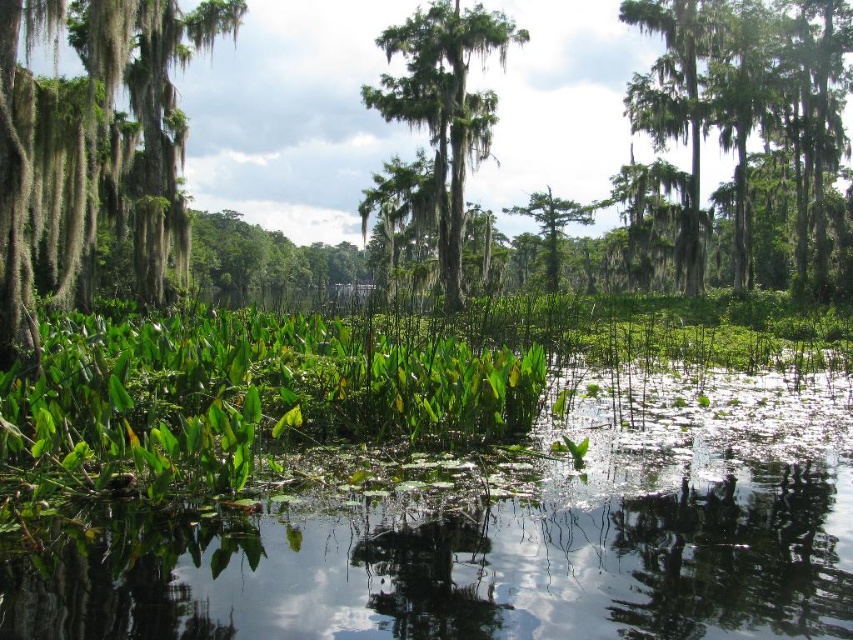
Question: Which point is farther to the camera?

Choices:
 (A) (544, 216)
 (B) (439, 51)
 (C) (788, 20)

Answer: (A)

Question: Based on their relative distances, which object is nearer to the green mossy tree at left?

Choices:
 (A) green leafy tree at center
 (B) green mossy tree at upper right

Answer: (B)

Question: Can you confirm if green mossy tree at left is smaller than green mossy tree at upper right?

Choices:
 (A) no
 (B) yes

Answer: (B)

Question: Can you confirm if green mossy tree at upper right is thinner than green leafy tree at center?

Choices:
 (A) no
 (B) yes

Answer: (A)

Question: Considering the real-world distances, which object is farthest from the green leafy tree at center?

Choices:
 (A) green mossy tree at left
 (B) green mossy tree at center
 (C) green mossy tree at upper right

Answer: (A)

Question: Observing the image, what is the correct spatial positioning of green mossy tree at left in reference to green mossy tree at upper right?

Choices:
 (A) below
 (B) above

Answer: (A)